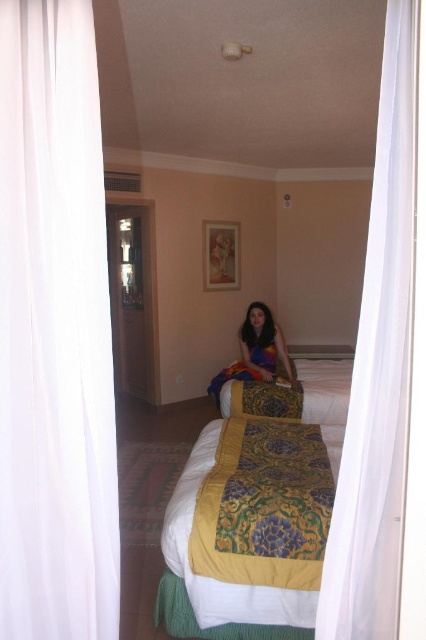
Locate an element on the screen. white sheer curtain at right is located at coordinates pyautogui.click(x=377, y=372).

Is white sheer curtain at right closer to camera compared to multicolored fabric at center?

Yes.

Is point (331, 524) more distant than point (256, 364)?

That is False.

This screenshot has width=426, height=640. In order to click on white sheer curtain at right in this screenshot , I will do `click(377, 372)`.

Who is positioned more to the left, patterned fabric bed at center or multicolored fabric at center?

Positioned to the left is patterned fabric bed at center.

Does patterned fabric bed at center have a greater height compared to multicolored fabric at center?

In fact, patterned fabric bed at center may be shorter than multicolored fabric at center.

At what (x,y) coordinates should I click in order to perform the action: click on patterned fabric bed at center. Please return your answer as a coordinate pair (x, y). The height and width of the screenshot is (640, 426). Looking at the image, I should click on (259, 508).

Who is positioned more to the right, patterned fabric bed at center or white sheer curtain at right?

white sheer curtain at right is more to the right.

Can you confirm if patterned fabric bed at center is wider than white sheer curtain at right?

Indeed, patterned fabric bed at center has a greater width compared to white sheer curtain at right.

This screenshot has width=426, height=640. I want to click on patterned fabric bed at center, so click(259, 508).